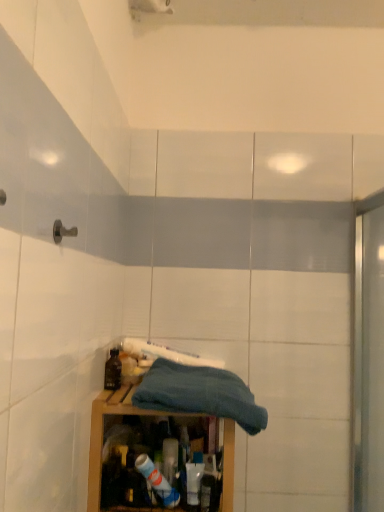
Where is `blue cotton towel at center`? The height and width of the screenshot is (512, 384). blue cotton towel at center is located at coordinates (200, 394).

Measure the distance between point (168,409) and camera.

The depth of point (168,409) is 1.05 meters.

Describe the element at coordinates (113, 371) in the screenshot. I see `matte black bottle at lower left` at that location.

Where is `wooden cabinet at lower center`? wooden cabinet at lower center is located at coordinates (103, 432).

The height and width of the screenshot is (512, 384). I want to click on blue cotton towel at center, so click(200, 394).

Is blue cotton towel at center turned away from wooden cabinet at lower center?

No, blue cotton towel at center is not facing the opposite direction of wooden cabinet at lower center.

From the image's perspective, which is above, blue cotton towel at center or wooden cabinet at lower center?

blue cotton towel at center, from the image's perspective.

How different are the orientations of blue cotton towel at center and wooden cabinet at lower center in degrees?

3.06 degrees separate the facing orientations of blue cotton towel at center and wooden cabinet at lower center.

Find the location of `towel that is above the wooden cabinet at lower center (from a real-world perspective)`. towel that is above the wooden cabinet at lower center (from a real-world perspective) is located at coordinates (200, 394).

Would you say blue cotton towel at center is inside or outside matte black bottle at lower left?

blue cotton towel at center exists outside the volume of matte black bottle at lower left.

Is point (218, 380) behind point (117, 383)?

No, it is in front of (117, 383).

From the image's perspective, who appears lower, blue cotton towel at center or matte black bottle at lower left?

blue cotton towel at center, from the image's perspective.

Is blue cotton towel at center beside matte black bottle at lower left?

blue cotton towel at center and matte black bottle at lower left are not in contact.

Does point (94, 419) lie in front of point (172, 374)?

Yes, point (94, 419) is closer to viewer.

From a real-world perspective, between wooden cabinet at lower center and blue cotton towel at center, who is vertically higher?

In real-world perspective, blue cotton towel at center is above.

Between wooden cabinet at lower center and blue cotton towel at center, which one is positioned in front?

Positioned in front is blue cotton towel at center.

Measure the distance between wooden cabinet at lower center and blue cotton towel at center.

A distance of 10.26 centimeters exists between wooden cabinet at lower center and blue cotton towel at center.

From a real-world perspective, is wooden cabinet at lower center physically below matte black bottle at lower left?

Yes, from a real-world perspective, wooden cabinet at lower center is below matte black bottle at lower left.

Image resolution: width=384 pixels, height=512 pixels. Find the location of `bottle that appears on the left of wooden cabinet at lower center`. bottle that appears on the left of wooden cabinet at lower center is located at coordinates (113, 371).

Is wooden cabinet at lower center next to matte black bottle at lower left?

wooden cabinet at lower center is not next to matte black bottle at lower left, and they're not touching.

Is point (109, 358) less distant than point (188, 378)?

No, (109, 358) is further to viewer.

Between matte black bottle at lower left and blue cotton towel at center, which one has smaller width?

matte black bottle at lower left.

Does matte black bottle at lower left appear on the right side of blue cotton towel at center?

No, matte black bottle at lower left is not to the right of blue cotton towel at center.

From a real-world perspective, between matte black bottle at lower left and blue cotton towel at center, who is vertically lower?

From a 3D spatial view, blue cotton towel at center is below.

Consider the image. Is matte black bottle at lower left thinner than wooden cabinet at lower center?

Indeed, matte black bottle at lower left has a lesser width compared to wooden cabinet at lower center.

Which of these two, matte black bottle at lower left or wooden cabinet at lower center, is bigger?

wooden cabinet at lower center.

Does matte black bottle at lower left appear on the left side of wooden cabinet at lower center?

Yes, matte black bottle at lower left is to the left of wooden cabinet at lower center.

From the image's perspective, is matte black bottle at lower left beneath wooden cabinet at lower center?

Actually, matte black bottle at lower left appears above wooden cabinet at lower center in the image.

What are the coordinates of `towel located in front of the wooden cabinet at lower center` in the screenshot? It's located at (200, 394).

Image resolution: width=384 pixels, height=512 pixels. Find the location of `bottle lying above the blue cotton towel at center (from the image's perspective)`. bottle lying above the blue cotton towel at center (from the image's perspective) is located at coordinates (113, 371).

Looking at the image, which one is located closer to wooden cabinet at lower center, matte black bottle at lower left or blue cotton towel at center?

Based on the image, blue cotton towel at center appears to be nearer to wooden cabinet at lower center.

Looking at the image, which one is located further to matte black bottle at lower left, blue cotton towel at center or wooden cabinet at lower center?

Among the two, blue cotton towel at center is located further to matte black bottle at lower left.

Considering their positions, is wooden cabinet at lower center positioned further to matte black bottle at lower left than blue cotton towel at center?

Based on the image, blue cotton towel at center appears to be further to matte black bottle at lower left.

Looking at the image, which one is located further to blue cotton towel at center, wooden cabinet at lower center or matte black bottle at lower left?

matte black bottle at lower left is positioned further to the anchor blue cotton towel at center.

Which object lies further to the anchor point blue cotton towel at center, matte black bottle at lower left or wooden cabinet at lower center?

Based on the image, matte black bottle at lower left appears to be further to blue cotton towel at center.

Looking at the image, which one is located closer to wooden cabinet at lower center, blue cotton towel at center or matte black bottle at lower left?

Based on the image, blue cotton towel at center appears to be nearer to wooden cabinet at lower center.

Image resolution: width=384 pixels, height=512 pixels. I want to click on towel between matte black bottle at lower left and wooden cabinet at lower center from top to bottom, so click(200, 394).